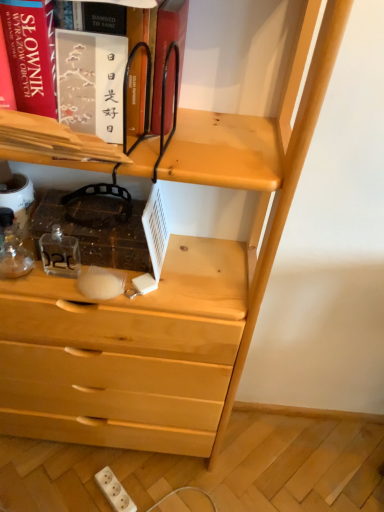
Question: From a real-world perspective, is white plastic electric outlet at lower center above or below matte black book at upper left?

Choices:
 (A) below
 (B) above

Answer: (A)

Question: In terms of height, does white plastic electric outlet at lower center look taller or shorter compared to matte black book at upper left?

Choices:
 (A) short
 (B) tall

Answer: (A)

Question: Do you think white plastic electric outlet at lower center is within matte black book at upper left, or outside of it?

Choices:
 (A) inside
 (B) outside

Answer: (B)

Question: Do you think matte black book at upper left is within white plastic electric outlet at lower center, or outside of it?

Choices:
 (A) inside
 (B) outside

Answer: (B)

Question: Is matte black book at upper left to the left or to the right of white plastic electric outlet at lower center in the image?

Choices:
 (A) right
 (B) left

Answer: (A)

Question: Is matte black book at upper left wider or thinner than white plastic electric outlet at lower center?

Choices:
 (A) thin
 (B) wide

Answer: (B)

Question: From the image's perspective, is matte black book at upper left above or below white plastic electric outlet at lower center?

Choices:
 (A) below
 (B) above

Answer: (B)